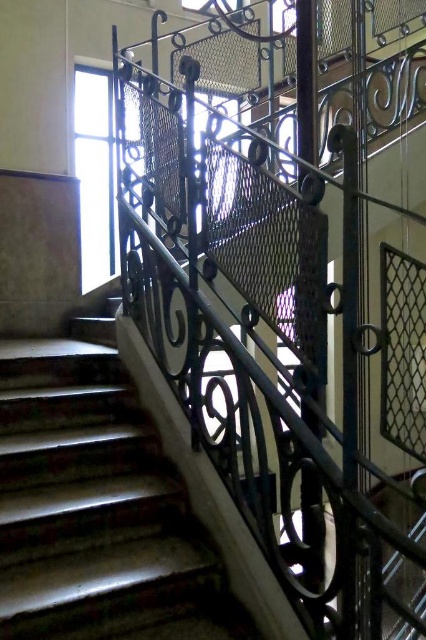
You are an interior designer assessing the staircase area. You notice the black wrought iron at upper center and the shiny brown stairs at center. Which object would you need a larger storage container for if you were to replace them?

The black wrought iron at upper center is larger in size than the shiny brown stairs at center, so you would need a larger storage container for the black wrought iron at upper center.

You are standing at the bottom of the staircase and want to touch both the black wrought iron at upper center and the shiny brown stairs at center. Which object will you reach first?

You will reach the black wrought iron at upper center first because it is closer to you than the shiny brown stairs at center.

You are standing at the bottom of the staircase and want to grab the black wrought iron at upper center. Can you reach it without moving closer?

The black wrought iron at upper center is 1.04 meters away from camera, so if you are at the bottom of the staircase, you are likely too far to reach it without moving closer.